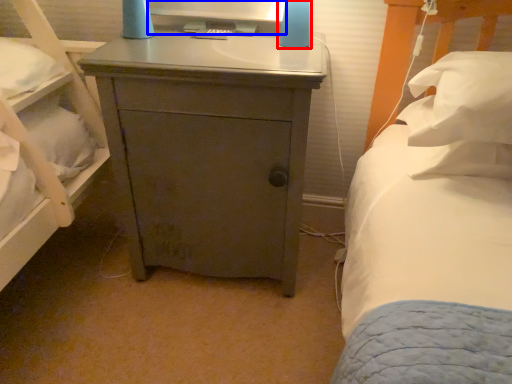
Question: Which object appears closest to the camera in this image, bedside lamp (highlighted by a red box) or computer monitor (highlighted by a blue box)?

Choices:
 (A) bedside lamp
 (B) computer monitor

Answer: (A)